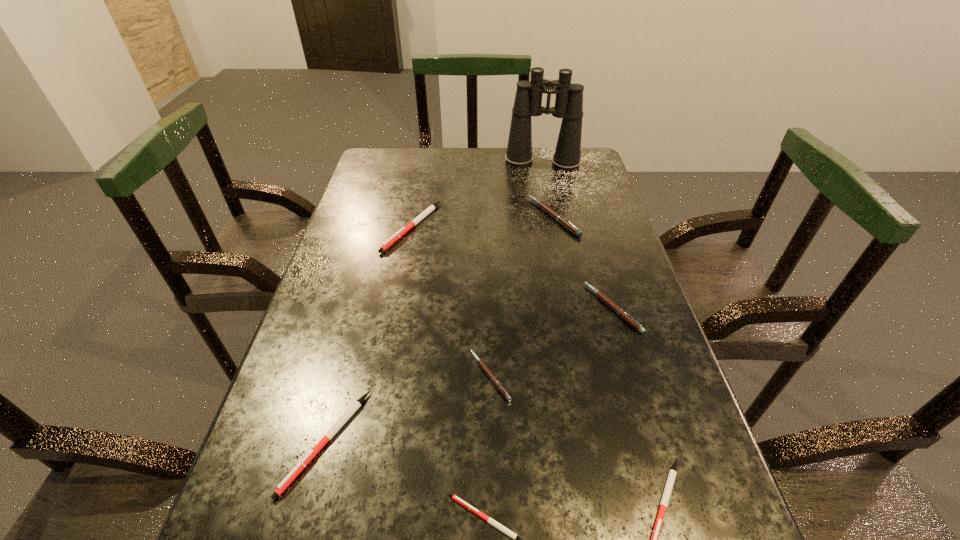
Point out which white pen is positioned as the third nearest to the farthest white pen. Please provide its 2D coordinates. Your answer should be formatted as a tuple, i.e. [(x, y)], where the tuple contains the x and y coordinates of a point satisfying the conditions above.

[(672, 474)]

This screenshot has width=960, height=540. I want to click on free spot that satisfies the following two spatial constraints: 1. at the nib of the nearest pink pen; 2. on the clicker of the second biggest white pen, so click(x=492, y=441).

Locate an element on the screen. Image resolution: width=960 pixels, height=540 pixels. vacant space that satisfies the following two spatial constraints: 1. at the nib of the second nearest pink pen; 2. on the clicker of the second biggest white pen is located at coordinates (653, 441).

In order to click on free location that satisfies the following two spatial constraints: 1. at the nib of the farthest pink pen; 2. on the clicker of the third smallest white pen in this screenshot , I will do `click(601, 441)`.

In order to click on vacant area in the image that satisfies the following two spatial constraints: 1. at the nib of the farthest pink pen; 2. on the clicker of the third smallest white pen in this screenshot , I will do `click(601, 441)`.